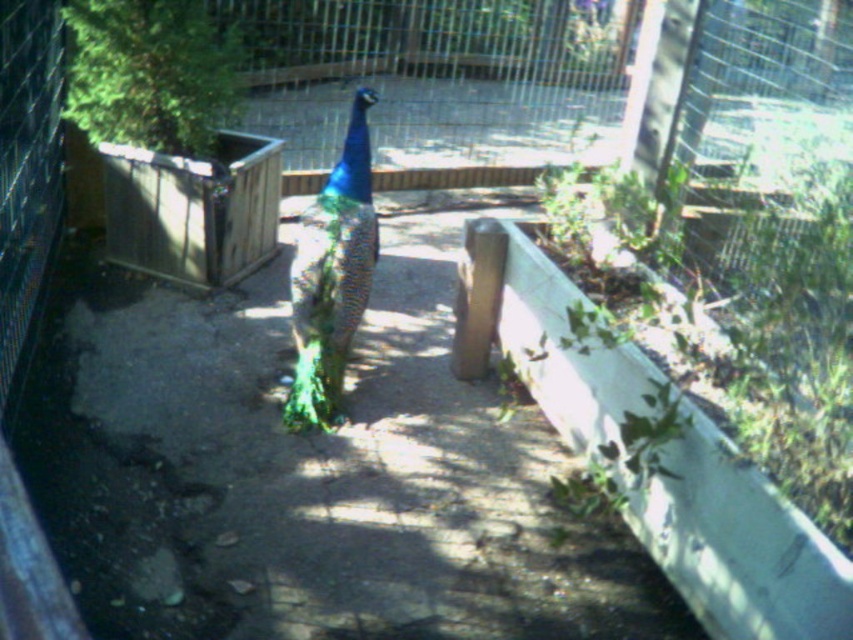
Question: Is green iridescent peacock at center above shiny iridescent peacock at center?

Choices:
 (A) no
 (B) yes

Answer: (A)

Question: Does green iridescent peacock at center appear over shiny iridescent peacock at center?

Choices:
 (A) no
 (B) yes

Answer: (A)

Question: Which of these objects is positioned farthest from the shiny iridescent peacock at center?

Choices:
 (A) green leafy plant at upper left
 (B) green iridescent peacock at center

Answer: (A)

Question: Which object is closer to the camera taking this photo?

Choices:
 (A) shiny iridescent peacock at center
 (B) green iridescent peacock at center

Answer: (B)

Question: Which point appears closest to the camera in this image?

Choices:
 (A) (334, 188)
 (B) (184, 61)
 (C) (479, 524)

Answer: (C)

Question: Can you confirm if green iridescent peacock at center is thinner than shiny iridescent peacock at center?

Choices:
 (A) no
 (B) yes

Answer: (A)